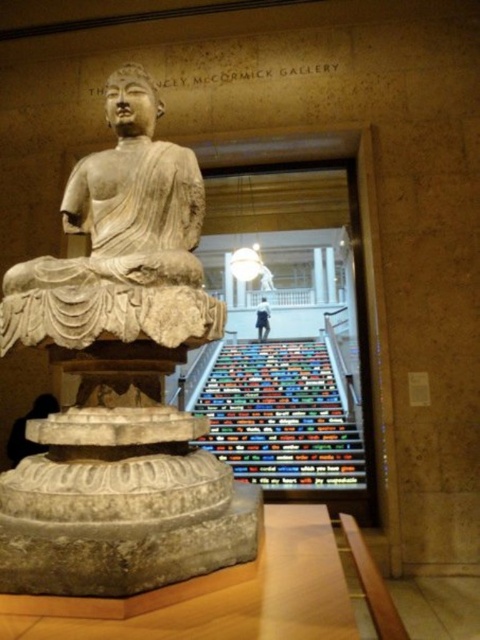
Question: Does stone statue at center appear on the left side of multicolored carpeted stairs at center?

Choices:
 (A) yes
 (B) no

Answer: (A)

Question: Which point is farther from the camera taking this photo?

Choices:
 (A) (347, 448)
 (B) (202, 195)
 (C) (33, 561)

Answer: (A)

Question: Among these points, which one is nearest to the camera?

Choices:
 (A) (127, 221)
 (B) (265, 355)

Answer: (A)

Question: Which point appears farthest from the camera in this image?

Choices:
 (A) (184, 252)
 (B) (118, 548)

Answer: (A)

Question: Does stone statue at center appear on the left side of beige stone statue at center?

Choices:
 (A) no
 (B) yes

Answer: (A)

Question: Does stone statue at center have a larger size compared to beige stone statue at center?

Choices:
 (A) yes
 (B) no

Answer: (A)